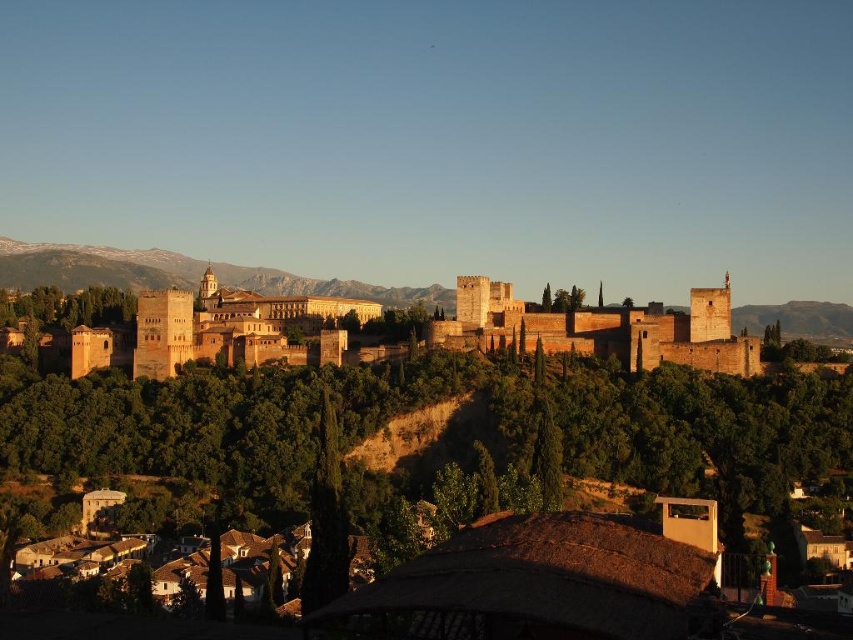
Can you confirm if green leafy tree at center is bigger than snowy rock formation at upper left?

Indeed, green leafy tree at center has a larger size compared to snowy rock formation at upper left.

Can you confirm if green leafy tree at center is positioned above snowy rock formation at upper left?

Actually, green leafy tree at center is below snowy rock formation at upper left.

Locate an element on the screen. This screenshot has width=853, height=640. green leafy tree at center is located at coordinates (447, 428).

Looking at this image, can you confirm if brown stone fort at center is positioned above snowy rock formation at upper left?

Actually, brown stone fort at center is below snowy rock formation at upper left.

The image size is (853, 640). Identify the location of brown stone fort at center. (601, 330).

Can you confirm if green leafy tree at center is thinner than brown stone fort at center?

Incorrect, green leafy tree at center's width is not less than brown stone fort at center's.

Does point (297, 481) come in front of point (494, 284)?

That is True.

Identify the location of green leafy tree at center. This screenshot has height=640, width=853. 447,428.